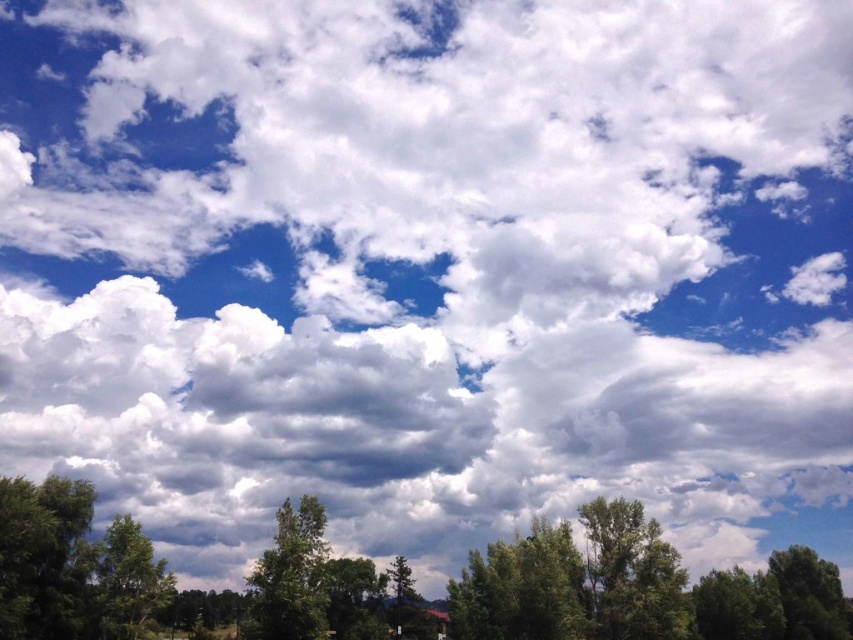
You are standing in a park and see the green leafy tree at center and the green leafy tree at lower left. Which tree is positioned more to the east if you are facing north?

The green leafy tree at center is positioned more to the east because it is to the right of the green leafy tree at lower left when facing north.

You are standing in a park and see a point marked at coordinates (x=172, y=577). Based on the scene description, what object is located at that point?

The point at coordinates (x=172, y=577) corresponds to the green leafy tree at lower center.